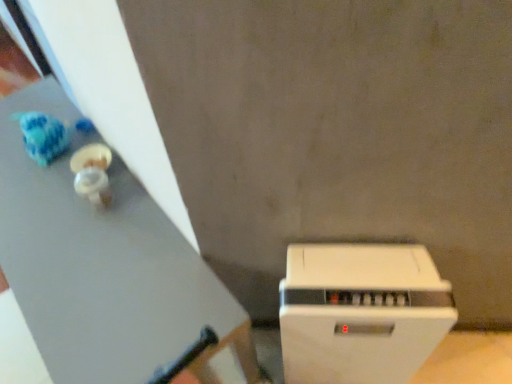
Question: Is white matte table at upper left to the left or to the right of white plastic toaster at lower right in the image?

Choices:
 (A) left
 (B) right

Answer: (A)

Question: From the image's perspective, is white matte table at upper left above or below white plastic toaster at lower right?

Choices:
 (A) above
 (B) below

Answer: (A)

Question: Is white matte table at upper left in front of or behind white plastic toaster at lower right in the image?

Choices:
 (A) behind
 (B) front

Answer: (A)

Question: Is white plastic toaster at lower right wider or thinner than white matte table at upper left?

Choices:
 (A) wide
 (B) thin

Answer: (B)

Question: Considering the positions of white plastic toaster at lower right and white matte table at upper left in the image, is white plastic toaster at lower right bigger or smaller than white matte table at upper left?

Choices:
 (A) big
 (B) small

Answer: (B)

Question: Would you say white plastic toaster at lower right is inside or outside white matte table at upper left?

Choices:
 (A) inside
 (B) outside

Answer: (B)

Question: From a real-world perspective, is white plastic toaster at lower right above or below white matte table at upper left?

Choices:
 (A) below
 (B) above

Answer: (B)